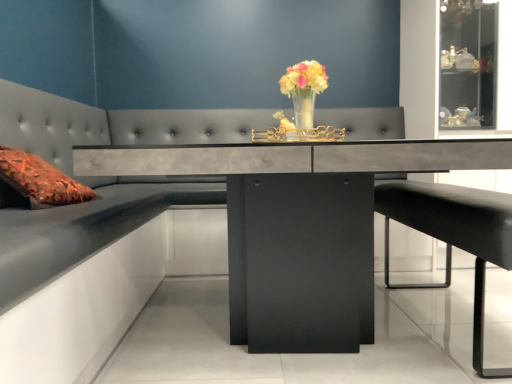
Question: Is concrete gray table at center positioned behind translucent glass vase at center?

Choices:
 (A) yes
 (B) no

Answer: (B)

Question: Is concrete gray table at center bigger than translucent glass vase at center?

Choices:
 (A) no
 (B) yes

Answer: (B)

Question: Can you confirm if concrete gray table at center is positioned to the left of translucent glass vase at center?

Choices:
 (A) no
 (B) yes

Answer: (B)

Question: Can you confirm if concrete gray table at center is taller than translucent glass vase at center?

Choices:
 (A) yes
 (B) no

Answer: (A)

Question: From the image's perspective, does concrete gray table at center appear higher than translucent glass vase at center?

Choices:
 (A) yes
 (B) no

Answer: (B)

Question: Is concrete gray table at center at the right side of translucent glass vase at center?

Choices:
 (A) yes
 (B) no

Answer: (B)

Question: Is the depth of translucent glass vase at center greater than that of concrete gray table at center?

Choices:
 (A) no
 (B) yes

Answer: (B)

Question: Is translucent glass vase at center placed right next to concrete gray table at center?

Choices:
 (A) no
 (B) yes

Answer: (A)

Question: Is translucent glass vase at center taller than concrete gray table at center?

Choices:
 (A) no
 (B) yes

Answer: (A)

Question: Does translucent glass vase at center appear on the left side of concrete gray table at center?

Choices:
 (A) no
 (B) yes

Answer: (A)

Question: Considering the relative sizes of translucent glass vase at center and concrete gray table at center in the image provided, is translucent glass vase at center wider than concrete gray table at center?

Choices:
 (A) no
 (B) yes

Answer: (A)

Question: Is translucent glass vase at center smaller than concrete gray table at center?

Choices:
 (A) yes
 (B) no

Answer: (A)

Question: Is translucent glass vase at center far away from black leather bar stool at lower right?

Choices:
 (A) no
 (B) yes

Answer: (A)